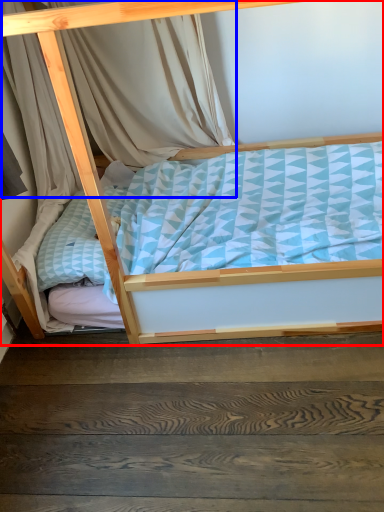
Question: Which point is further to the camera, bed (highlighted by a red box) or curtain (highlighted by a blue box)?

Choices:
 (A) bed
 (B) curtain

Answer: (B)